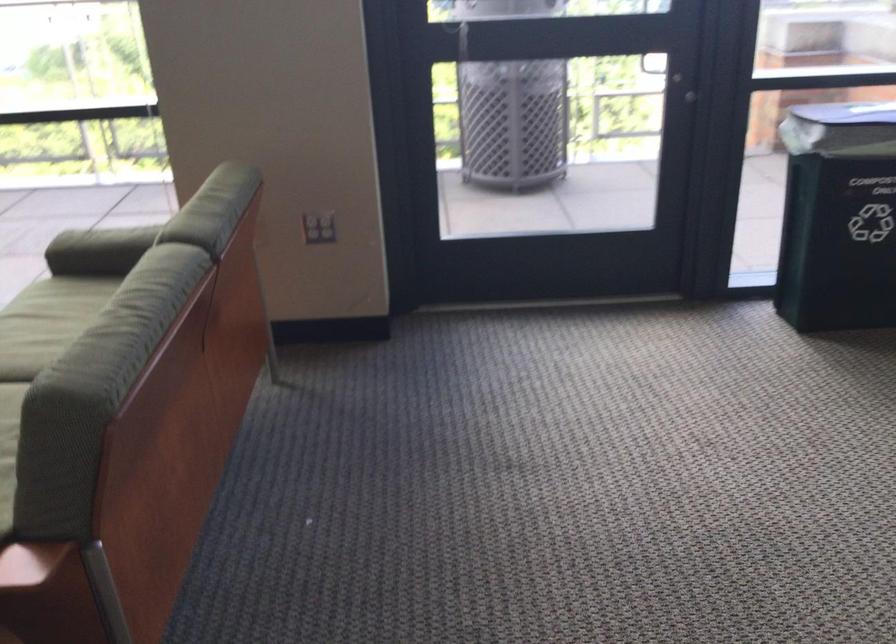
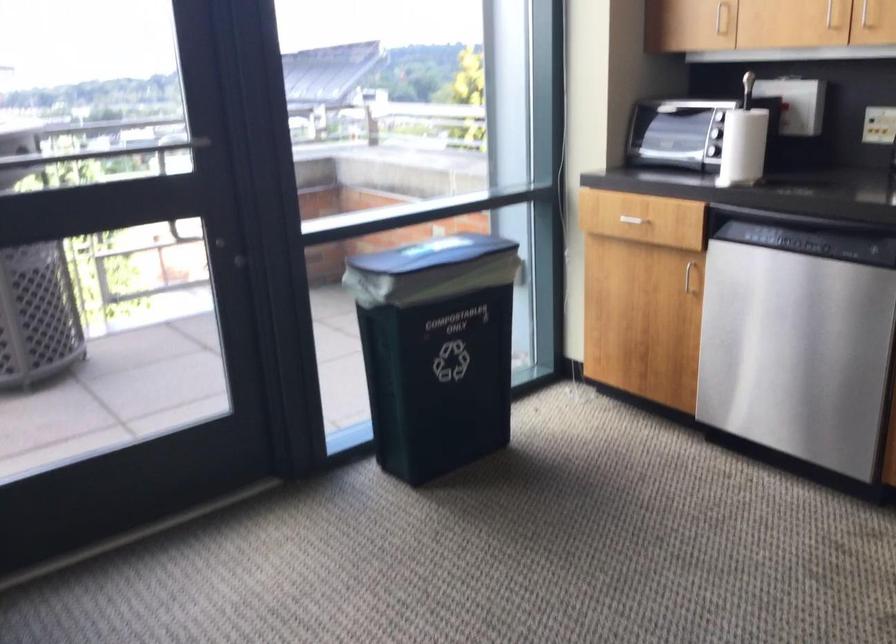
Find the pixel in the second image that matches pixel 677 82 in the first image.

(231, 254)